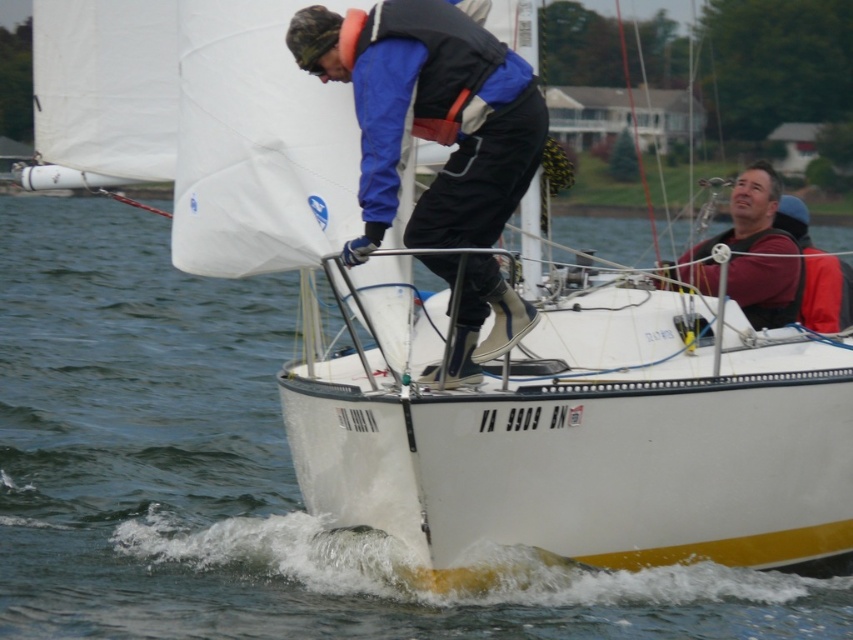
You are a photographer on a nearby boat trying to capture a clear photo of the matte blue jacket at center and the white water at center. Based on their heights, which one will appear larger in the photo?

The white water at center has a greater height compared to the matte blue jacket at center, so it will appear larger in the photo.

You are a photographer trying to capture the sailboat scene. You have two points marked on your viewfinder at coordinates point (529, 326) and point (734, 280). Which point is closer to you?

Point (529, 326) is closer to the viewer than point (734, 280).

You are a sailor on the white sailboat marked VA 9909 BN. You notice a point marked at coordinates (x=242, y=476). What is located at that point?

The point at coordinates (x=242, y=476) marks white water at center.